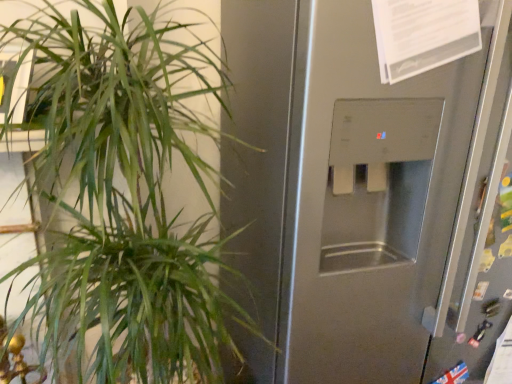
Measure the distance between point [155,119] and camera.

They are 29.92 inches apart.

What do you see at coordinates (125, 199) in the screenshot? I see `green leafy plant at left` at bounding box center [125, 199].

Find the location of a particular element. The height and width of the screenshot is (384, 512). green leafy plant at left is located at coordinates (125, 199).

The height and width of the screenshot is (384, 512). What do you see at coordinates (378, 199) in the screenshot?
I see `satin silver dispenser at center` at bounding box center [378, 199].

At what (x,y) coordinates should I click in order to perform the action: click on satin silver dispenser at center. Please return your answer as a coordinate pair (x, y). Image resolution: width=512 pixels, height=384 pixels. Looking at the image, I should click on (378, 199).

Where is `green leafy plant at left`? green leafy plant at left is located at coordinates (125, 199).

Does satin silver dispenser at center appear on the left side of green leafy plant at left?

Incorrect, satin silver dispenser at center is not on the left side of green leafy plant at left.

Is satin silver dispenser at center positioned behind green leafy plant at left?

Yes, satin silver dispenser at center is further from the camera.

Is point (403, 183) in front of point (91, 315)?

No, (403, 183) is further to viewer.

From the image's perspective, is satin silver dispenser at center located above or below green leafy plant at left?

satin silver dispenser at center is situated higher than green leafy plant at left in the image.

From a real-world perspective, is satin silver dispenser at center positioned above or below green leafy plant at left?

Clearly, from a real-world perspective, satin silver dispenser at center is below green leafy plant at left.

Does satin silver dispenser at center have a lesser width compared to green leafy plant at left?

In fact, satin silver dispenser at center might be wider than green leafy plant at left.

Which of these two, satin silver dispenser at center or green leafy plant at left, stands taller?

With more height is satin silver dispenser at center.

Considering the relative sizes of satin silver dispenser at center and green leafy plant at left in the image provided, is satin silver dispenser at center bigger than green leafy plant at left?

Indeed, satin silver dispenser at center has a larger size compared to green leafy plant at left.

Would you say green leafy plant at left is part of satin silver dispenser at center's contents?

No, satin silver dispenser at center does not contain green leafy plant at left.

Does satin silver dispenser at center touch green leafy plant at left?

satin silver dispenser at center and green leafy plant at left are not in contact.

Is satin silver dispenser at center looking in the opposite direction of green leafy plant at left?

That's not correct — satin silver dispenser at center is not looking away from green leafy plant at left.

How many degrees apart are the facing directions of satin silver dispenser at center and green leafy plant at left?

satin silver dispenser at center and green leafy plant at left are facing 1.08 degrees away from each other.

At what (x,y) coordinates should I click in order to perform the action: click on houseplant that appears above the satin silver dispenser at center (from a real-world perspective). Please return your answer as a coordinate pair (x, y). This screenshot has height=384, width=512. Looking at the image, I should click on (125, 199).

Does green leafy plant at left appear on the left side of satin silver dispenser at center?

Yes, green leafy plant at left is to the left of satin silver dispenser at center.

Who is more distant, green leafy plant at left or satin silver dispenser at center?

Positioned behind is satin silver dispenser at center.

Which point is more forward, (218, 372) or (327, 312)?

The point (218, 372) is in front.

Based on the photo, from the image's perspective, between green leafy plant at left and satin silver dispenser at center, which one is located above?

satin silver dispenser at center is shown above in the image.

From a real-world perspective, is green leafy plant at left beneath satin silver dispenser at center?

No, from a real-world perspective, green leafy plant at left is not under satin silver dispenser at center.

Which object is thinner, green leafy plant at left or satin silver dispenser at center?

green leafy plant at left is thinner.

Considering the relative sizes of green leafy plant at left and satin silver dispenser at center in the image provided, is green leafy plant at left shorter than satin silver dispenser at center?

Indeed, green leafy plant at left has a lesser height compared to satin silver dispenser at center.

Which of these two, green leafy plant at left or satin silver dispenser at center, is smaller?

With smaller size is green leafy plant at left.

Is green leafy plant at left inside or outside of satin silver dispenser at center?

green leafy plant at left is not inside satin silver dispenser at center, it's outside.

Is there a large distance between green leafy plant at left and satin silver dispenser at center?

They are positioned close to each other.

Is green leafy plant at left facing away from satin silver dispenser at center?

No, green leafy plant at left is not facing away from satin silver dispenser at center.

Based on the photo, how different are the orientations of green leafy plant at left and satin silver dispenser at center in degrees?

1.08 degrees separate the facing orientations of green leafy plant at left and satin silver dispenser at center.

Looking at this image, how much distance is there between green leafy plant at left and satin silver dispenser at center?

They are 14.33 inches apart.

Identify the location of houseplant lying in front of the satin silver dispenser at center. Image resolution: width=512 pixels, height=384 pixels. (125, 199).

Locate an element on the screen. This screenshot has width=512, height=384. houseplant below the satin silver dispenser at center (from the image's perspective) is located at coordinates (125, 199).

Locate an element on the screen. screen door above the green leafy plant at left (from the image's perspective) is located at coordinates (378, 199).